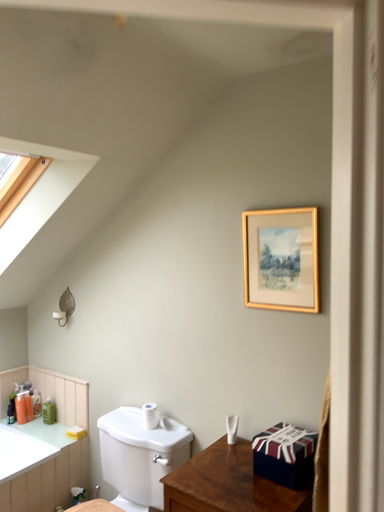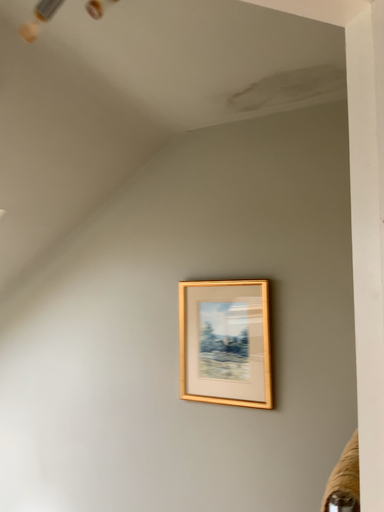
Question: How did the camera likely rotate when shooting the video?

Choices:
 (A) rotated right
 (B) rotated left

Answer: (A)